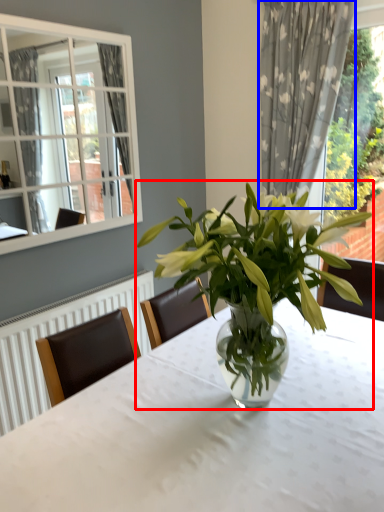
Question: Which point is closer to the camera, houseplant (highlighted by a red box) or curtain (highlighted by a blue box)?

Choices:
 (A) houseplant
 (B) curtain

Answer: (A)